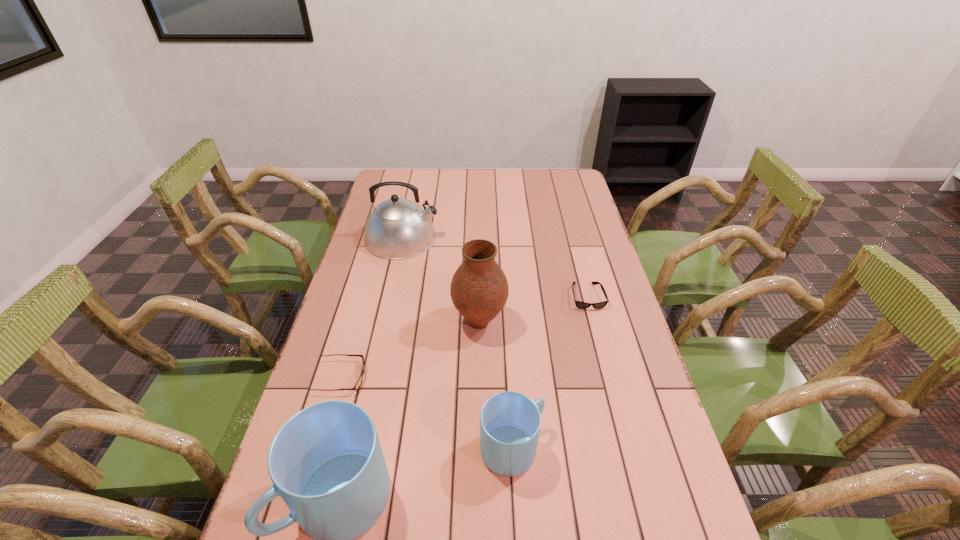
Where is `vacant area that satisfies the following two spatial constraints: 1. from the spout of the third shortest object; 2. on the left side of the kettle`? vacant area that satisfies the following two spatial constraints: 1. from the spout of the third shortest object; 2. on the left side of the kettle is located at coordinates (354, 449).